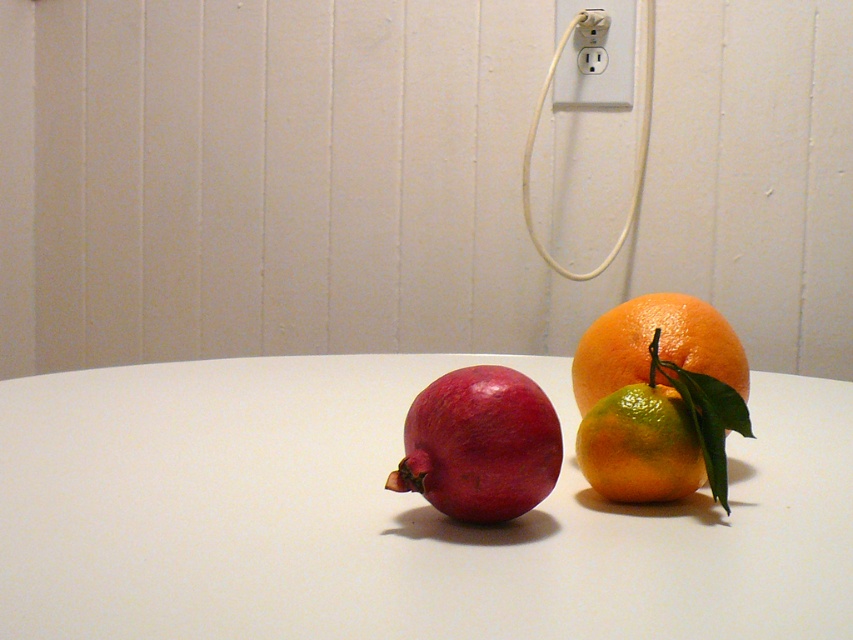
You are arranging fruits on a table for a photo shoot. You have an orange matte at right and a shiny green lime at center right. The photographer wants to know which fruit is taller. Which one should you point out?

The orange matte at right is taller than the shiny green lime at center right.